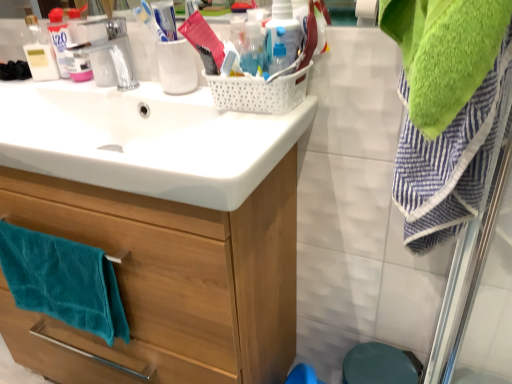
Question: From a real-world perspective, is translucent plastic bottle at upper center, which is the first bottle in left-to-right order, positioned above or below teal soft towel at lower left?

Choices:
 (A) above
 (B) below

Answer: (A)

Question: From the image's perspective, is translucent plastic bottle at upper center, the second bottle viewed from the right, located above or below teal soft towel at lower left?

Choices:
 (A) below
 (B) above

Answer: (B)

Question: Considering the real-world distances, which object is closest to the translucent plastic bottle at upper center, which is the first bottle in left-to-right order?

Choices:
 (A) white glossy sink at upper center
 (B) translucent plastic bottle at upper center, the 1th bottle from the right
 (C) wooden cabinet at center
 (D) teal soft towel at lower left

Answer: (B)

Question: Estimate the real-world distances between objects in this image. Which object is closer to the wooden cabinet at center?

Choices:
 (A) translucent plastic bottle at upper center, the 1th bottle from the right
 (B) white glossy sink at upper center
 (C) teal soft towel at lower left
 (D) translucent plastic bottle at upper center, which is the first bottle in left-to-right order

Answer: (C)